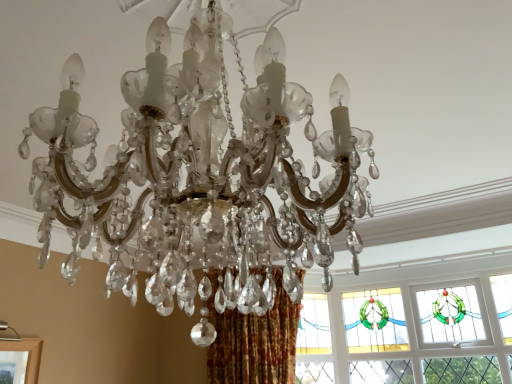
What is the approximate width of stained glass window at upper right?

It is 5.40 inches.

Measure the distance between stained glass window at upper right and camera.

stained glass window at upper right is 2.89 meters from camera.

The height and width of the screenshot is (384, 512). I want to click on stained glass window at upper right, so click(413, 327).

The height and width of the screenshot is (384, 512). What do you see at coordinates (413, 327) in the screenshot?
I see `stained glass window at upper right` at bounding box center [413, 327].

Measure the distance between clear crystal chandelier at center and camera.

A distance of 22.43 inches exists between clear crystal chandelier at center and camera.

I want to click on clear crystal chandelier at center, so click(202, 176).

Image resolution: width=512 pixels, height=384 pixels. What do you see at coordinates (202, 176) in the screenshot?
I see `clear crystal chandelier at center` at bounding box center [202, 176].

The width and height of the screenshot is (512, 384). Find the location of `stained glass window at upper right`. stained glass window at upper right is located at coordinates pos(413,327).

Which object is positioned more to the right, clear crystal chandelier at center or stained glass window at upper right?

stained glass window at upper right is more to the right.

Is clear crystal chandelier at center in front of or behind stained glass window at upper right in the image?

clear crystal chandelier at center is positioned closer to the viewer than stained glass window at upper right.

Between point (119, 210) and point (495, 293), which one is positioned behind?

Positioned behind is point (495, 293).

From the image's perspective, is clear crystal chandelier at center on top of stained glass window at upper right?

Yes.

From a real-world perspective, relative to stained glass window at upper right, is clear crystal chandelier at center vertically above or below?

In terms of real-world spatial position, clear crystal chandelier at center is above stained glass window at upper right.

Looking at their sizes, would you say clear crystal chandelier at center is wider or thinner than stained glass window at upper right?

In the image, clear crystal chandelier at center appears to be wider than stained glass window at upper right.

From the picture: Can you confirm if clear crystal chandelier at center is taller than stained glass window at upper right?

No.

From the picture: Considering the sizes of objects clear crystal chandelier at center and stained glass window at upper right in the image provided, who is bigger, clear crystal chandelier at center or stained glass window at upper right?

Bigger between the two is clear crystal chandelier at center.

Is clear crystal chandelier at center inside the boundaries of stained glass window at upper right, or outside?

The correct answer is: outside.

Is clear crystal chandelier at center far away from stained glass window at upper right?

Yes.

Is clear crystal chandelier at center turned away from stained glass window at upper right?

clear crystal chandelier at center does not have its back to stained glass window at upper right.

How different are the orientations of clear crystal chandelier at center and stained glass window at upper right in degrees?

There is a 93.7-degree angle between the facing directions of clear crystal chandelier at center and stained glass window at upper right.

Image resolution: width=512 pixels, height=384 pixels. I want to click on window that appears below the clear crystal chandelier at center (from a real-world perspective), so click(413, 327).

Can you confirm if stained glass window at upper right is positioned to the right of clear crystal chandelier at center?

Yes.

Which object is closer to the camera, stained glass window at upper right or clear crystal chandelier at center?

clear crystal chandelier at center is more forward.

Is point (341, 317) closer to camera compared to point (346, 207)?

No, (341, 317) is behind (346, 207).

From the picture: From the image's perspective, which one is positioned lower, stained glass window at upper right or clear crystal chandelier at center?

stained glass window at upper right appears lower in the image.

From a real-world perspective, which is physically below, stained glass window at upper right or clear crystal chandelier at center?

stained glass window at upper right.

Considering the relative sizes of stained glass window at upper right and clear crystal chandelier at center in the image provided, is stained glass window at upper right thinner than clear crystal chandelier at center?

Correct, the width of stained glass window at upper right is less than that of clear crystal chandelier at center.

Who is shorter, stained glass window at upper right or clear crystal chandelier at center?

clear crystal chandelier at center is shorter.

Which of these two, stained glass window at upper right or clear crystal chandelier at center, is smaller?

stained glass window at upper right.

Is stained glass window at upper right completely or partially outside of clear crystal chandelier at center?

Indeed, stained glass window at upper right is completely outside clear crystal chandelier at center.

Is stained glass window at upper right beside clear crystal chandelier at center?

No, stained glass window at upper right is not making contact with clear crystal chandelier at center.

Is stained glass window at upper right facing towards clear crystal chandelier at center?

Yes, stained glass window at upper right is oriented towards clear crystal chandelier at center.

How many degrees apart are the facing directions of stained glass window at upper right and clear crystal chandelier at center?

There is a 93.7-degree angle between the facing directions of stained glass window at upper right and clear crystal chandelier at center.

Image resolution: width=512 pixels, height=384 pixels. Find the location of `window below the clear crystal chandelier at center (from the image's perspective)`. window below the clear crystal chandelier at center (from the image's perspective) is located at coordinates (413, 327).

In order to click on window below the clear crystal chandelier at center (from the image's perspective) in this screenshot , I will do `click(413, 327)`.

In order to click on window beneath the clear crystal chandelier at center (from a real-world perspective) in this screenshot , I will do `click(413, 327)`.